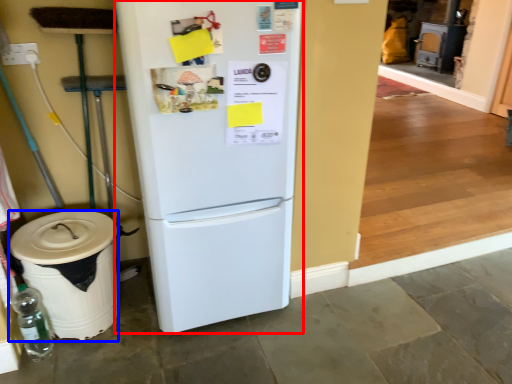
Question: Which object appears closest to the camera in this image, refrigerator (highlighted by a red box) or trash bin/can (highlighted by a blue box)?

Choices:
 (A) refrigerator
 (B) trash bin/can

Answer: (A)